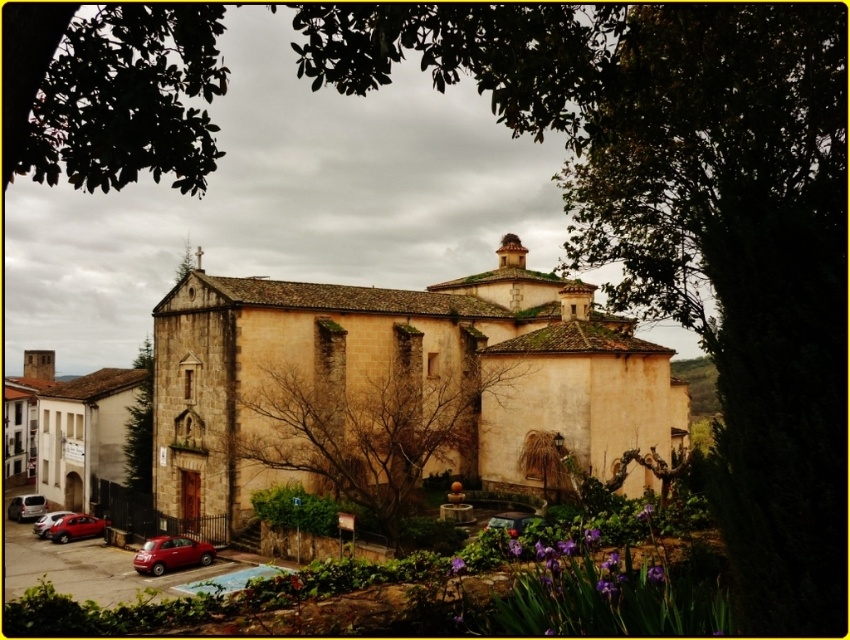
Is the position of beige stone church at center more distant than that of metallic red car at lower left?

No, beige stone church at center is in front of metallic red car at lower left.

Who is more forward, [459,435] or [94,534]?

Point [94,534] is more forward.

Who is more distant from viewer, (340, 397) or (80, 532)?

Positioned behind is point (80, 532).

Locate an element on the screen. This screenshot has height=640, width=850. beige stone church at center is located at coordinates (394, 387).

Looking at this image, is beige stone church at center wider than brown textured tree at center?

Yes.

Between beige stone church at center and brown textured tree at center, which one appears on the left side from the viewer's perspective?

brown textured tree at center

Identify the location of beige stone church at center. The image size is (850, 640). (394, 387).

The height and width of the screenshot is (640, 850). I want to click on beige stone church at center, so click(x=394, y=387).

Is shiny red car at lower left taller than metallic silver car at lower left?

No.

Locate an element on the screen. shiny red car at lower left is located at coordinates (171, 554).

Is point (174, 541) in front of point (38, 502)?

Yes, point (174, 541) is closer to viewer.

Find the location of a particular element. shiny red car at lower left is located at coordinates (171, 554).